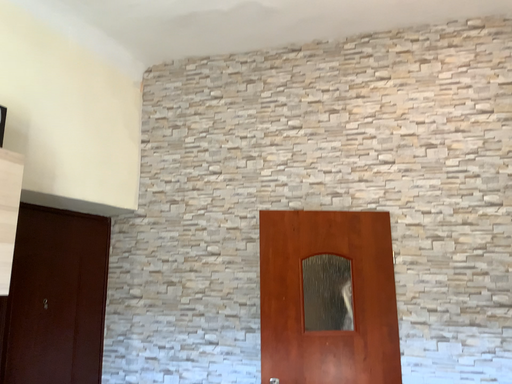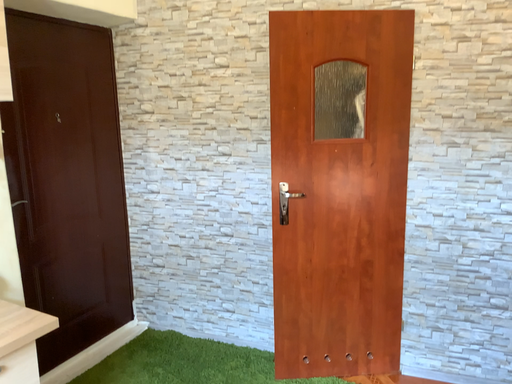
Question: How did the camera likely rotate when shooting the video?

Choices:
 (A) rotated upward
 (B) rotated downward

Answer: (B)